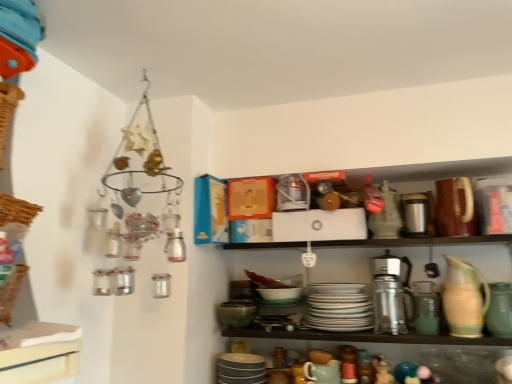
Question: Would you say woven brown basket at left is part of metallic silver thermos at lower right's contents?

Choices:
 (A) yes
 (B) no

Answer: (B)

Question: Does metallic silver thermos at lower right have a lesser height compared to woven brown basket at left?

Choices:
 (A) no
 (B) yes

Answer: (A)

Question: Is metallic silver thermos at lower right completely or partially outside of woven brown basket at left?

Choices:
 (A) yes
 (B) no

Answer: (A)

Question: Is metallic silver thermos at lower right not close to woven brown basket at left?

Choices:
 (A) no
 (B) yes

Answer: (B)

Question: Does metallic silver thermos at lower right have a larger size compared to woven brown basket at left?

Choices:
 (A) yes
 (B) no

Answer: (A)

Question: From a real-world perspective, is matte ceramic mug at lower center, the fourth tableware when ordered from right to left, above or below metallic silver thermos at lower right?

Choices:
 (A) below
 (B) above

Answer: (A)

Question: From the image's perspective, is matte ceramic mug at lower center, the fourth tableware when ordered from right to left, above or below metallic silver thermos at lower right?

Choices:
 (A) above
 (B) below

Answer: (B)

Question: Does point (306, 369) appear closer or farther from the camera than point (374, 332)?

Choices:
 (A) farther
 (B) closer

Answer: (B)

Question: Based on their sizes in the image, would you say matte ceramic mug at lower center, positioned as the second tableware in left-to-right order, is bigger or smaller than metallic silver thermos at lower right?

Choices:
 (A) big
 (B) small

Answer: (B)

Question: Is point (483, 289) closer or farther from the camera than point (380, 312)?

Choices:
 (A) farther
 (B) closer

Answer: (B)

Question: Do you think speckled ceramic pitcher at right, which is the fourth tableware from left to right, is within metallic silver thermos at lower right, or outside of it?

Choices:
 (A) outside
 (B) inside

Answer: (A)

Question: From a real-world perspective, is speckled ceramic pitcher at right, which is the 2th tableware in right-to-left order, positioned above or below metallic silver thermos at lower right?

Choices:
 (A) above
 (B) below

Answer: (A)

Question: From the image's perspective, is speckled ceramic pitcher at right, which is the 2th tableware in right-to-left order, above or below metallic silver thermos at lower right?

Choices:
 (A) below
 (B) above

Answer: (B)

Question: Looking at the image, does metallic silver thermos at lower right seem bigger or smaller compared to white glossy plates at center, which is counted as the 3th tableware, starting from the right?

Choices:
 (A) small
 (B) big

Answer: (A)

Question: Considering the positions of point (399, 329) and point (321, 309), is point (399, 329) closer or farther from the camera than point (321, 309)?

Choices:
 (A) farther
 (B) closer

Answer: (A)